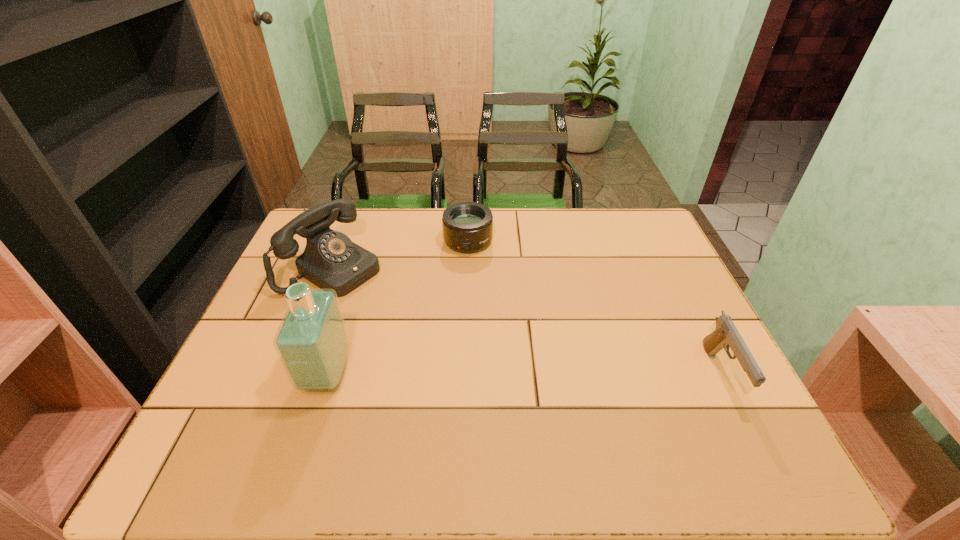
Identify the location of vacant area that lies between the second tallest object and the second object from right to left. (400, 254).

Where is `vacant area between the third object from left to right and the tallest object`? The height and width of the screenshot is (540, 960). vacant area between the third object from left to right and the tallest object is located at coordinates (397, 308).

At what (x,y) coordinates should I click in order to perform the action: click on vacant area between the telephoto lens and the second shortest object. Please return your answer as a coordinate pair (x, y). This screenshot has height=540, width=960. Looking at the image, I should click on (594, 308).

The height and width of the screenshot is (540, 960). I want to click on free space between the rightmost object and the third shortest object, so click(527, 321).

The image size is (960, 540). Identify the location of free spot between the tallest object and the shortest object. (397, 308).

Choose which object is the third nearest neighbor to the shortest object. Please provide its 2D coordinates. Your answer should be formatted as a tuple, i.e. [(x, y)], where the tuple contains the x and y coordinates of a point satisfying the conditions above.

[(726, 335)]

Where is `object identified as the closest to the second object from right to left`? This screenshot has height=540, width=960. object identified as the closest to the second object from right to left is located at coordinates (331, 260).

The image size is (960, 540). I want to click on free location that satisfies the following two spatial constraints: 1. on the front side of the telephone; 2. on the front label of the perfume, so tap(291, 375).

This screenshot has height=540, width=960. Find the location of `vacant space that satisfies the following two spatial constraints: 1. on the back side of the telephone; 2. on the left side of the shortest object`. vacant space that satisfies the following two spatial constraints: 1. on the back side of the telephone; 2. on the left side of the shortest object is located at coordinates (343, 242).

I want to click on vacant space that satisfies the following two spatial constraints: 1. on the back side of the second tallest object; 2. on the left side of the shortest object, so click(x=343, y=242).